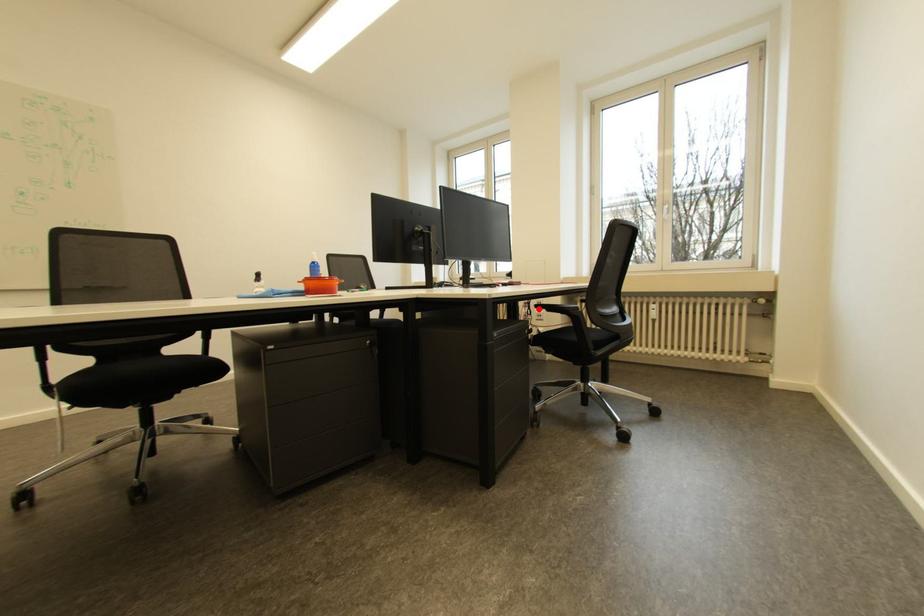
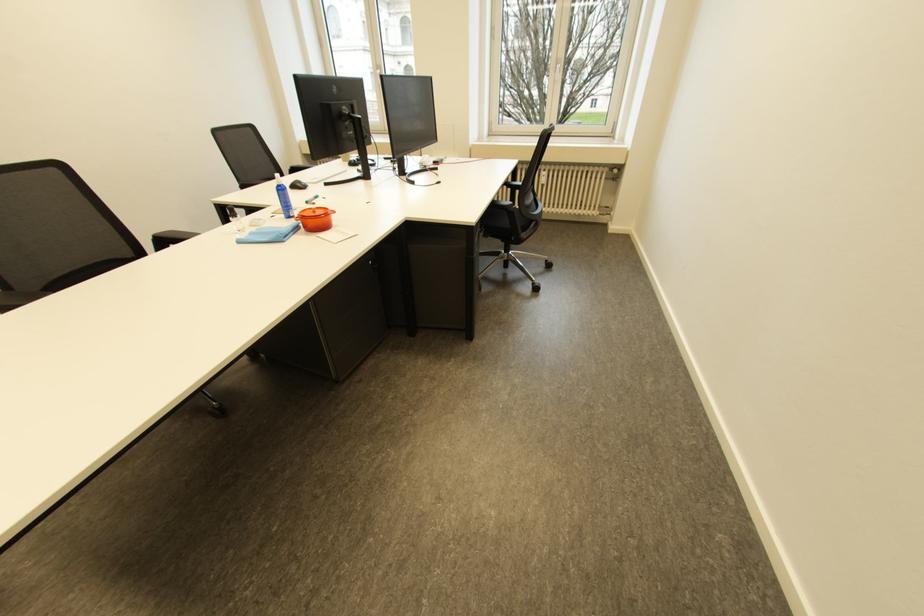
Question: I am providing you with two images of the same scene from different viewpoints. A red point is marked on the first image. Is the red point's position out of view in image 2?

Choices:
 (A) Yes
 (B) No

Answer: (A)